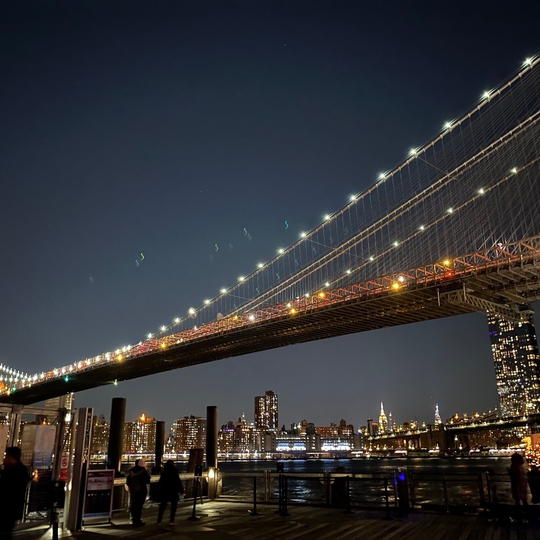
Where is `lights`? The width and height of the screenshot is (540, 540). lights is located at coordinates coord(158,265).